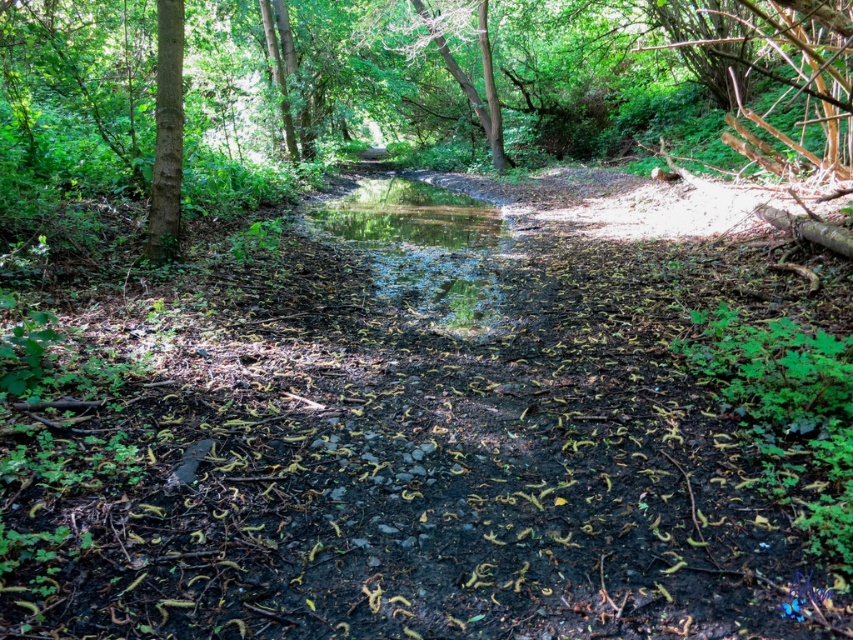
You are a hiker who wants to cross the stream. You see the green reflective water at center and the smooth bark tree at left. Which one is taller?

The green reflective water at center has a greater height compared to the smooth bark tree at left, so the green reflective water at center is taller.

You are planning to cross the forest and need to know the size of the green reflective water at center and the smooth bark tree at left. Which one has a bigger size?

The green reflective water at center is larger in size than the smooth bark tree at left.